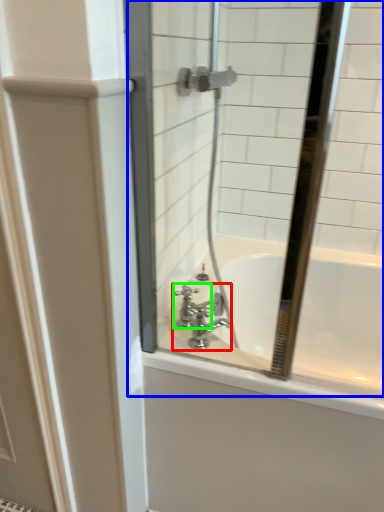
Question: Considering the real-world distances, which object is closest to tap (highlighted by a red box)? mirror (highlighted by a blue box) or faucet (highlighted by a green box).

Choices:
 (A) mirror
 (B) faucet

Answer: (B)